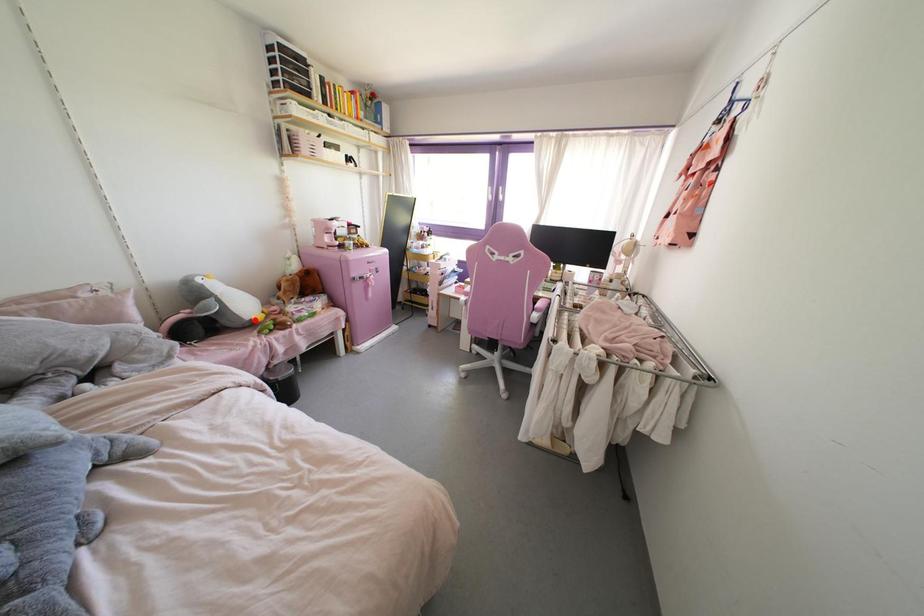
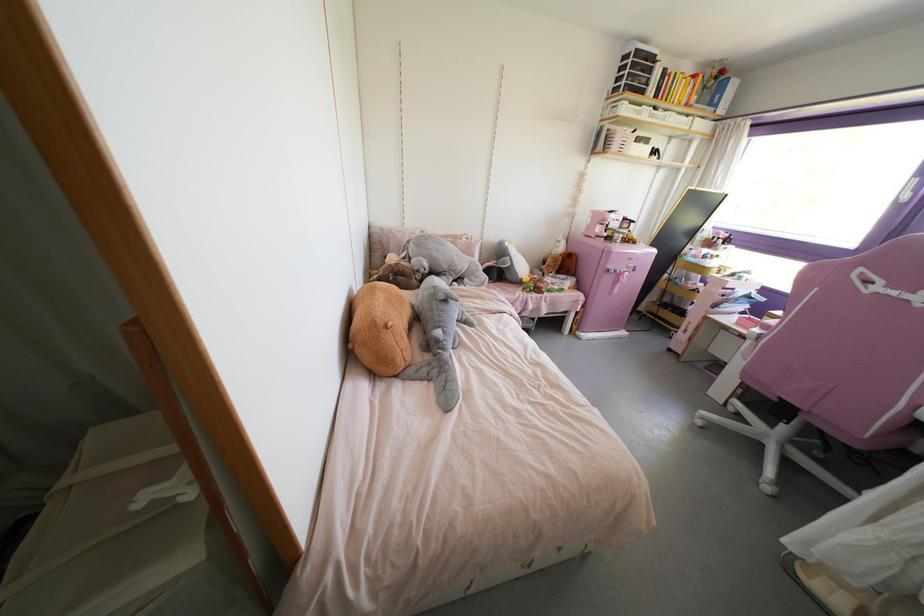
Find the pixel in the second image that matches the highlighted location in the first image.

(523, 280)